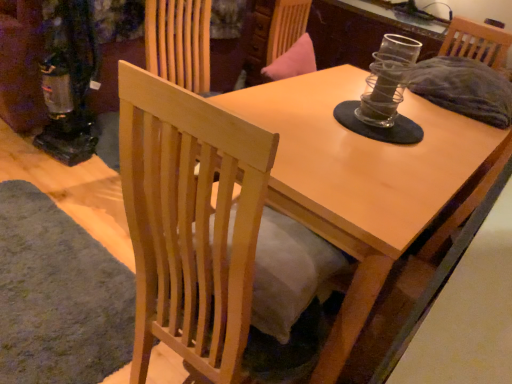
Question: Is soft gray carpet at lower left taller than natural wood chair at center?

Choices:
 (A) no
 (B) yes

Answer: (A)

Question: Is soft gray carpet at lower left with natural wood chair at center?

Choices:
 (A) yes
 (B) no

Answer: (B)

Question: Is soft gray carpet at lower left thinner than natural wood chair at center?

Choices:
 (A) no
 (B) yes

Answer: (A)

Question: Can you confirm if soft gray carpet at lower left is positioned to the left of natural wood chair at center?

Choices:
 (A) no
 (B) yes

Answer: (B)

Question: From the image's perspective, is soft gray carpet at lower left located beneath natural wood chair at center?

Choices:
 (A) no
 (B) yes

Answer: (B)

Question: Does soft gray carpet at lower left come behind natural wood chair at center?

Choices:
 (A) yes
 (B) no

Answer: (A)

Question: Is soft gray carpet at lower left behind light wood table at center?

Choices:
 (A) no
 (B) yes

Answer: (B)

Question: Is soft gray carpet at lower left thinner than light wood table at center?

Choices:
 (A) yes
 (B) no

Answer: (A)

Question: From the image's perspective, is soft gray carpet at lower left under light wood table at center?

Choices:
 (A) yes
 (B) no

Answer: (A)

Question: Can you confirm if soft gray carpet at lower left is taller than light wood table at center?

Choices:
 (A) no
 (B) yes

Answer: (A)

Question: Is soft gray carpet at lower left oriented towards light wood table at center?

Choices:
 (A) yes
 (B) no

Answer: (B)

Question: Is soft gray carpet at lower left looking in the opposite direction of light wood table at center?

Choices:
 (A) no
 (B) yes

Answer: (A)

Question: From a real-world perspective, is natural wood chair at center physically below soft gray carpet at lower left?

Choices:
 (A) yes
 (B) no

Answer: (B)